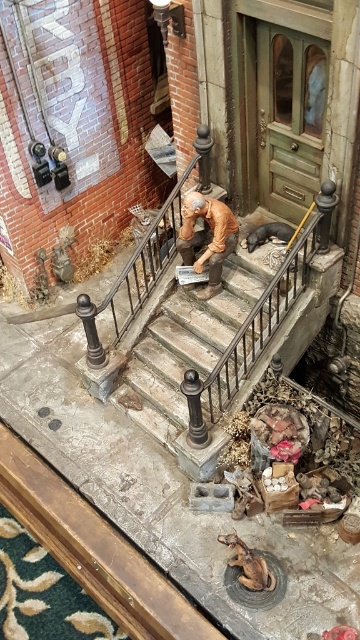
Does point (189, 250) come in front of point (272, 577)?

No.

Is point (210, 240) behind point (219, 536)?

Yes, it is behind point (219, 536).

This screenshot has height=640, width=360. What are the coordinates of `matte brown figure at center` in the screenshot? It's located at (206, 237).